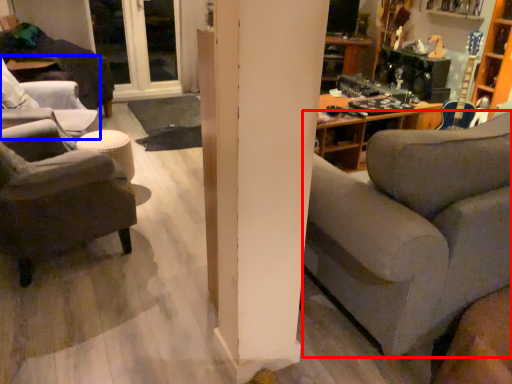
Question: Which object is further to the camera taking this photo, studio couch (highlighted by a red box) or chair (highlighted by a blue box)?

Choices:
 (A) studio couch
 (B) chair

Answer: (B)